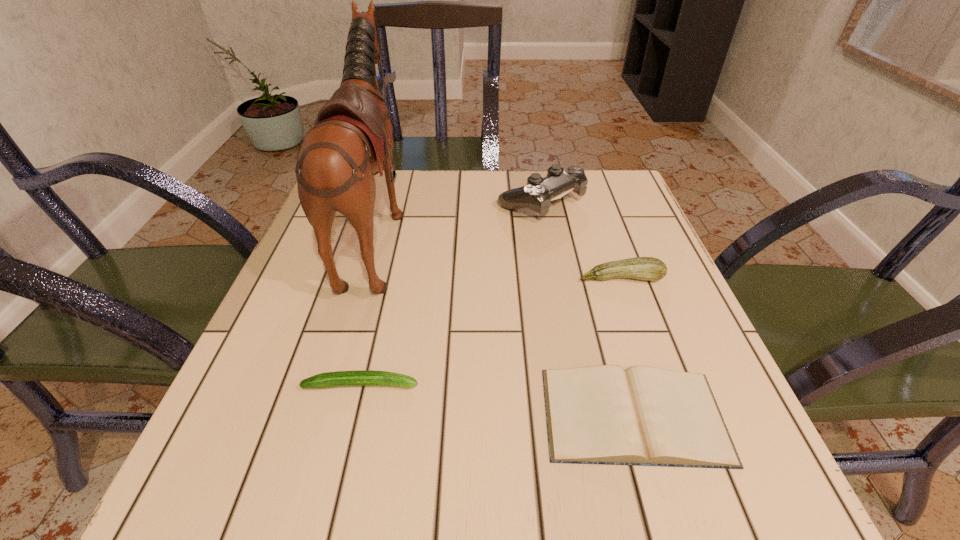
Locate an element on the screen. object that is at the far left corner is located at coordinates (352, 140).

Image resolution: width=960 pixels, height=540 pixels. Find the location of `object that is at the far right corner`. object that is at the far right corner is located at coordinates (536, 195).

Where is `object that is at the near right corner`? object that is at the near right corner is located at coordinates (643, 416).

Where is `vacant space at the far edge of the desktop`? The width and height of the screenshot is (960, 540). vacant space at the far edge of the desktop is located at coordinates point(415,220).

In order to click on vacant space at the left edge of the desktop in this screenshot , I will do [x=317, y=314].

You are a GUI agent. You are given a task and a screenshot of the screen. Output one action in this format:
    pyautogui.click(x=<x>, y=<y>)
    Task: Click on the free spot at the right edge of the desktop
    The height and width of the screenshot is (540, 960).
    Given the screenshot: What is the action you would take?
    pyautogui.click(x=624, y=316)

The width and height of the screenshot is (960, 540). What are the coordinates of `free space at the far left corner of the desktop` in the screenshot? It's located at (376, 210).

Image resolution: width=960 pixels, height=540 pixels. In order to click on vacant space at the near left corner in this screenshot , I will do `click(269, 488)`.

Identify the location of vacant space at the far right corner of the desktop. This screenshot has width=960, height=540. (589, 197).

Locate an element on the screen. The image size is (960, 540). vacant space that is in between the Bible and the fourth shortest object is located at coordinates (588, 308).